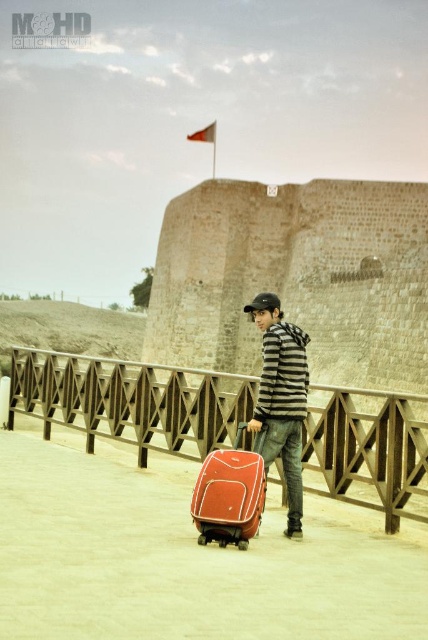
Can you confirm if wooden rail at center is taller than striped hoodie at center?

In fact, wooden rail at center may be shorter than striped hoodie at center.

Which is more to the left, wooden rail at center or striped hoodie at center?

wooden rail at center is more to the left.

Is point (424, 444) behind point (273, 392)?

That is False.

Find the location of a particular element. Image resolution: width=428 pixels, height=640 pixels. wooden rail at center is located at coordinates (130, 401).

Looking at this image, can you confirm if wooden rail at center is shorter than matte red suitcase at center?

No.

This screenshot has width=428, height=640. Identify the location of wooden rail at center. click(x=130, y=401).

You are a GUI agent. You are given a task and a screenshot of the screen. Output one action in this format:
    pyautogui.click(x=<x>, y=<y>)
    Task: Click on the wooden rail at center
    This screenshot has width=428, height=640.
    Given the screenshot: What is the action you would take?
    pyautogui.click(x=130, y=401)

Who is more forward, (290, 442) or (225, 528)?

Answer: Point (225, 528) is in front.

Does point (288, 400) lie in front of point (246, 524)?

No, it is not.

Is point (264, 380) more distant than point (244, 426)?

Yes.

The width and height of the screenshot is (428, 640). Identify the location of striped hoodie at center. (282, 397).